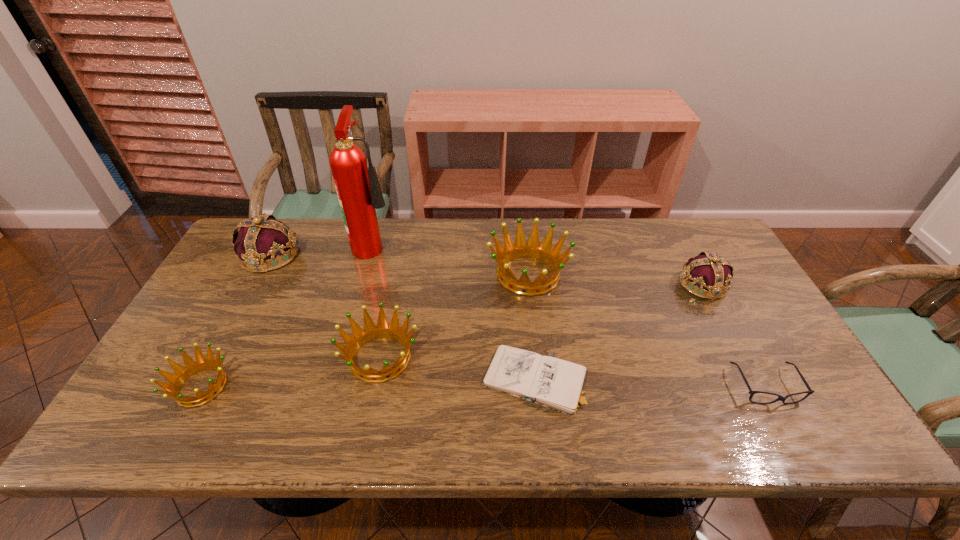
At what (x,y) coordinates should I click in order to perform the action: click on free spot located 0.080m on the front-facing side of the second shortest object. Please return your answer as a coordinate pair (x, y). This screenshot has height=540, width=960. Looking at the image, I should click on (796, 442).

Identify the location of vacant area situated 0.120m on the left of the notebook. (434, 380).

This screenshot has height=540, width=960. I want to click on fire extinguisher at the far edge, so click(x=359, y=193).

Where is `crown at the near edge`? The image size is (960, 540). crown at the near edge is located at coordinates (191, 367).

Locate an element on the screen. Image resolution: width=960 pixels, height=540 pixels. spectacles present at the near edge is located at coordinates (780, 398).

This screenshot has width=960, height=540. Identify the location of notebook at the near edge. (551, 382).

At what (x,y) coordinates should I click in order to perform the action: click on crown that is at the right edge. Please return your answer as a coordinate pair (x, y). The width and height of the screenshot is (960, 540). Looking at the image, I should click on (707, 271).

The width and height of the screenshot is (960, 540). I want to click on spectacles located in the right edge section of the desktop, so click(x=780, y=398).

Find the location of `object present at the far left corner`. object present at the far left corner is located at coordinates (261, 244).

Identify the location of object that is at the near left corner. (191, 367).